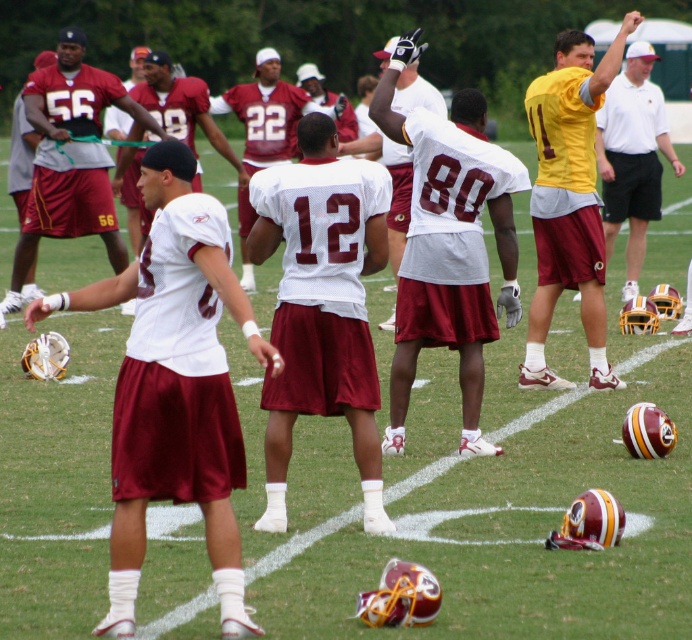
Does white matte jersey at center have a greater height compared to yellow jersey at upper right?

Correct, white matte jersey at center is much taller as yellow jersey at upper right.

Does point (455, 211) come farther from viewer compared to point (547, 168)?

That is False.

The height and width of the screenshot is (640, 692). Describe the element at coordinates (448, 248) in the screenshot. I see `white matte jersey at center` at that location.

Identify the location of white matte jersey at center. The width and height of the screenshot is (692, 640). (448, 248).

Measure the distance from white mesh jersey at center to maroon satin jersey at center.

white mesh jersey at center and maroon satin jersey at center are 6.36 meters apart from each other.

Is white mesh jersey at center smaller than maroon satin jersey at center?

No.

Where is `white mesh jersey at center`? The width and height of the screenshot is (692, 640). white mesh jersey at center is located at coordinates (320, 304).

What are the coordinates of `white mesh jersey at center` in the screenshot? It's located at (320, 304).

Between point (543, 362) and point (648, 147), which one is positioned behind?

Point (648, 147)

Does yellow jersey at upper right have a lesser width compared to yellow jersey at center?

Indeed, yellow jersey at upper right has a lesser width compared to yellow jersey at center.

Does point (572, 120) lie in front of point (628, 68)?

Yes, it is in front of point (628, 68).

I want to click on yellow jersey at upper right, so click(x=570, y=200).